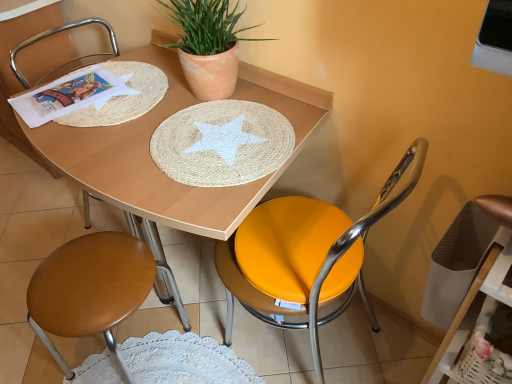
Question: In terms of height, does matte wood table at center look taller or shorter compared to metallic gold swivel chair at right?

Choices:
 (A) short
 (B) tall

Answer: (A)

Question: Considering the positions of point (298, 139) and point (464, 372), is point (298, 139) closer or farther from the camera than point (464, 372)?

Choices:
 (A) closer
 (B) farther

Answer: (B)

Question: Estimate the real-world distances between objects in this image. Which object is closer to the metallic yellow seat at center, which ranks as the third chair in left-to-right order?

Choices:
 (A) metallic gold swivel chair at right
 (B) metallic silver armchair at left
 (C) brown leather stool at lower left, the 2th chair viewed from the right
 (D) matte terracotta pot at upper center
 (E) brown leather stool at lower left, arranged as the first chair when viewed from the left

Answer: (A)

Question: Estimate the real-world distances between objects in this image. Which object is closer to the brown leather stool at lower left, the 2th chair viewed from the right?

Choices:
 (A) matte terracotta pot at upper center
 (B) brown leather stool at lower left, arranged as the first chair when viewed from the left
 (C) metallic gold swivel chair at right
 (D) matte wood table at center
 (E) metallic silver armchair at left

Answer: (D)